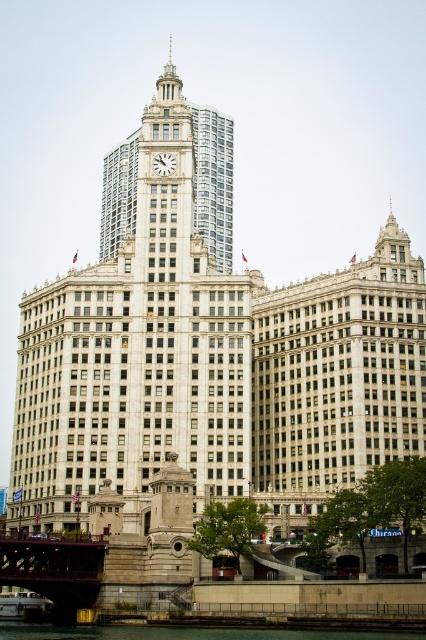
You are standing at the waterfront and want to take a photo of both the green concrete river at lower center and the white marble clock at center. Which object should you focus on first to ensure both are in the frame?

You should focus on the green concrete river at lower center first because it is closer to you than the white marble clock at center, ensuring both are in the frame.

You are standing at a viewpoint where you can see both historic buildings. A drone is flying at a point with coordinates point (22, 577). Can you estimate how far the drone is from your current position?

The distance of point (22, 577) from the camera is 59.22 meters, so the drone is approximately 59.22 meters away from your current position.

Consider the image. You are a tourist standing on the brown metal bridge at lower left, looking towards the green concrete river at lower center. Which object is closer to you?

The brown metal bridge at lower left is closer to you since you are standing on it, while the green concrete river at lower center is behind the bridge.